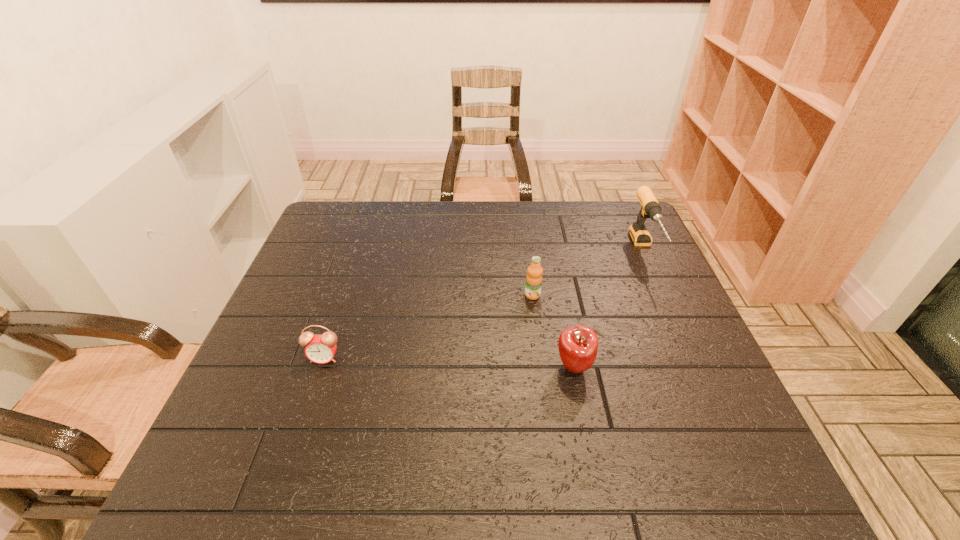
The image size is (960, 540). I want to click on object situated at the far edge, so click(650, 208).

The height and width of the screenshot is (540, 960). I want to click on object located in the left edge section of the desktop, so click(320, 349).

You are a GUI agent. You are given a task and a screenshot of the screen. Output one action in this format:
    pyautogui.click(x=<x>, y=<y>)
    Task: Click on the object that is positioned at the right edge
    This screenshot has height=540, width=960.
    Given the screenshot: What is the action you would take?
    pyautogui.click(x=650, y=208)

Locate an element on the screen. This screenshot has height=540, width=960. object that is at the far right corner is located at coordinates (650, 208).

Find the location of `vacant space at the far edge of the desktop`. vacant space at the far edge of the desktop is located at coordinates (482, 207).

In the image, there is a desktop. Where is `vacant area at the near edge`? The width and height of the screenshot is (960, 540). vacant area at the near edge is located at coordinates (673, 485).

Locate an element on the screen. vacant space at the left edge of the desktop is located at coordinates (246, 403).

In the image, there is a desktop. At what (x,y) coordinates should I click in order to perform the action: click on vacant space at the right edge. Please return your answer as a coordinate pair (x, y). Looking at the image, I should click on (655, 401).

Find the location of a particular element. The width and height of the screenshot is (960, 540). blank space at the near left corner of the desktop is located at coordinates (229, 458).

In order to click on vacant space at the near right corner of the desktop in this screenshot , I will do `click(722, 462)`.